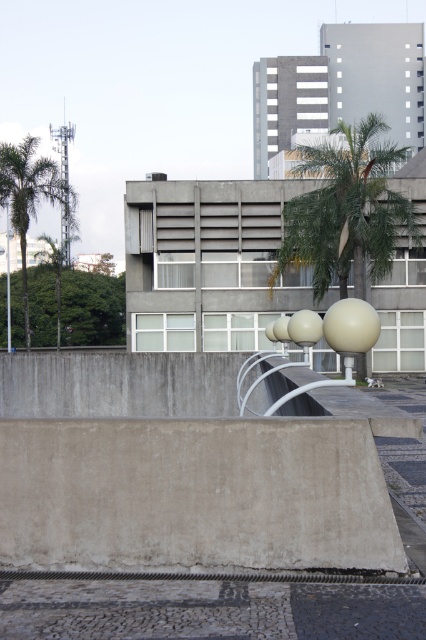
Between concrete at center and gray concrete at lower center, which one appears on the right side from the viewer's perspective?

concrete at center

The width and height of the screenshot is (426, 640). I want to click on concrete at center, so tap(198, 502).

Which is in front, point (120, 604) or point (316, 289)?

Point (120, 604) is in front.

Does gray concrete at lower center have a greater width compared to green leafy palm tree at upper right?

No, gray concrete at lower center is not wider than green leafy palm tree at upper right.

Identify the location of gray concrete at lower center. The image size is (426, 640). (209, 609).

Locate an element on the screen. The image size is (426, 640). gray concrete at lower center is located at coordinates (209, 609).

Which is above, gray concrete at lower center or green leafy palm tree at left?

green leafy palm tree at left is higher up.

Measure the distance from gray concrete at lower center to green leafy palm tree at left.

47.09 meters

The width and height of the screenshot is (426, 640). What do you see at coordinates (209, 609) in the screenshot?
I see `gray concrete at lower center` at bounding box center [209, 609].

Locate an element on the screen. The height and width of the screenshot is (640, 426). gray concrete at lower center is located at coordinates (209, 609).